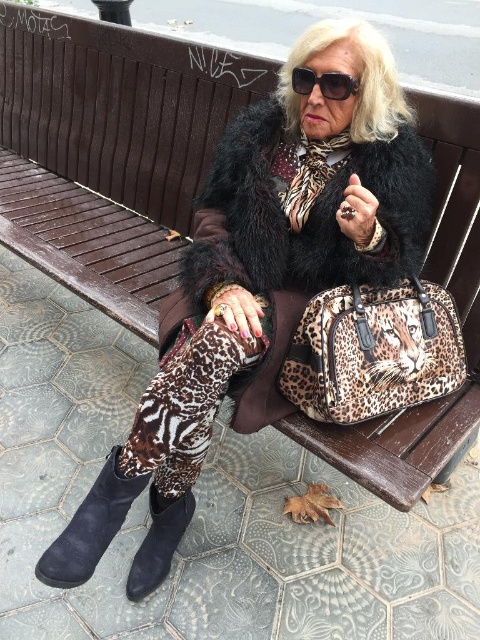
You are a photographer taking a closeup shot of the leopard print fabric handbag at center and the suede boot at lower left. Which object is closer to your camera lens?

The leopard print fabric handbag at center is closer to the camera lens because it is positioned further to the viewer than the suede boot at lower left.